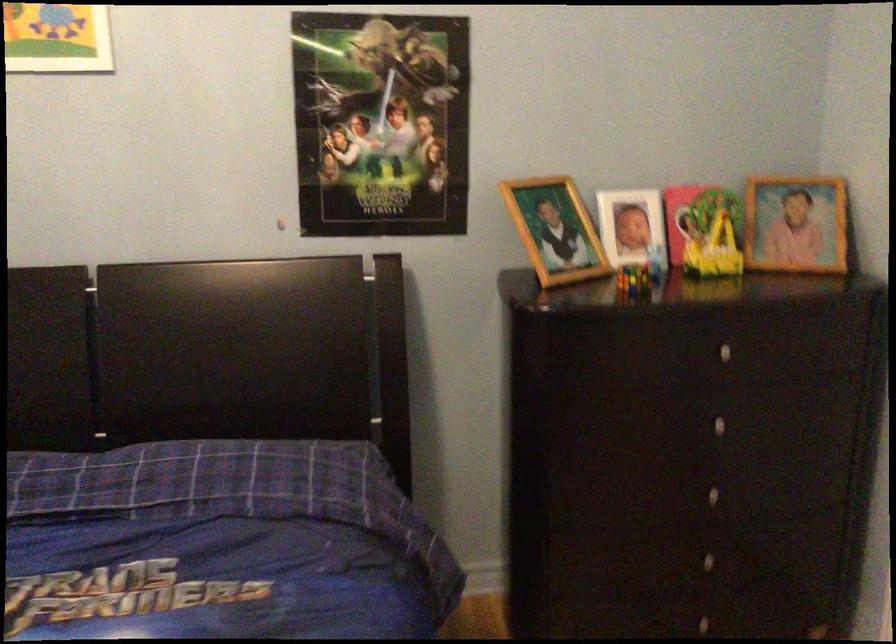
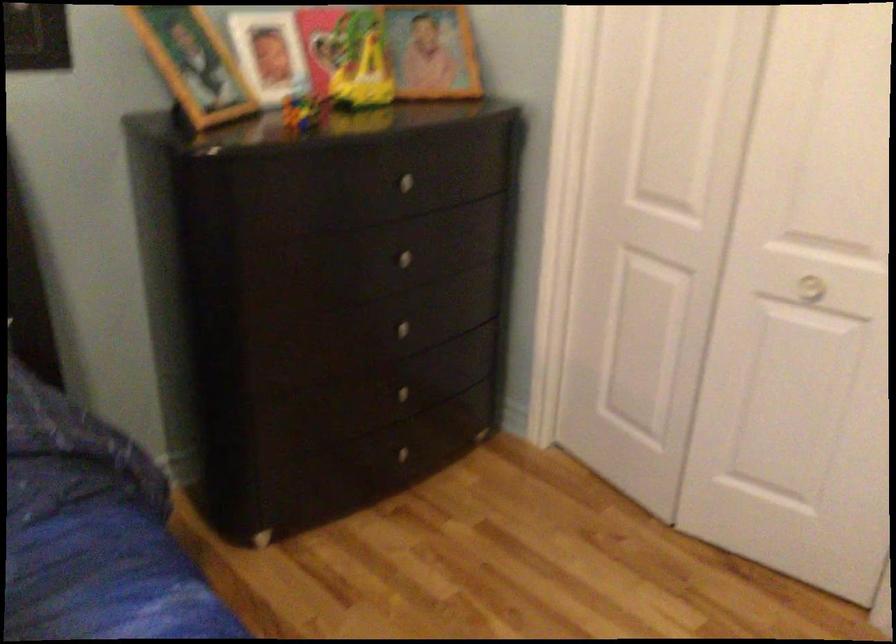
Locate, in the second image, the point that corresponds to the point at 718,498 in the first image.

(409, 332)